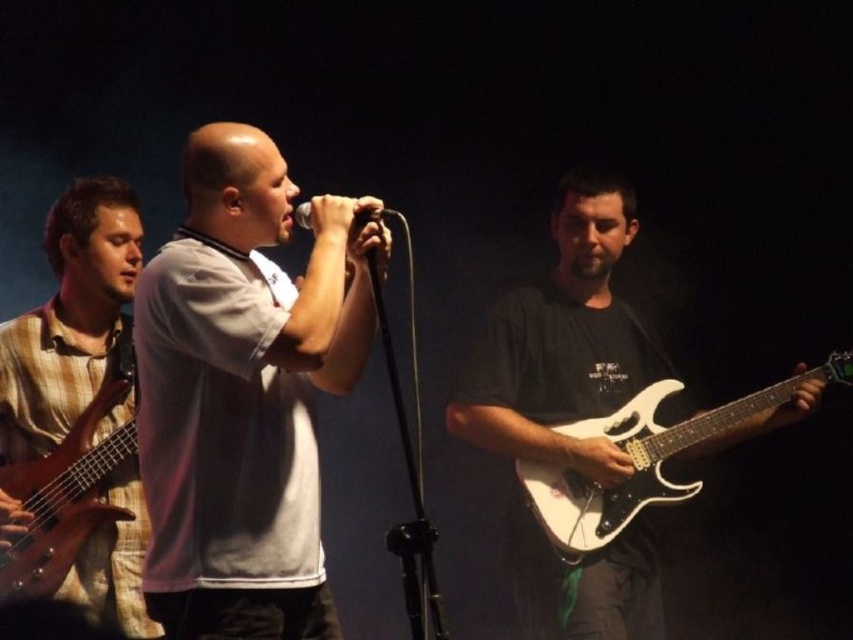
Question: Is white glossy electric guitar at right positioned behind wooden bass guitar at left?

Choices:
 (A) no
 (B) yes

Answer: (B)

Question: Which object is farther from the camera taking this photo?

Choices:
 (A) plaid fabric guitar at left
 (B) white glossy guitar at right

Answer: (B)

Question: Which point is closer to the camera?

Choices:
 (A) white matte shirt at center
 (B) wooden bass guitar at left
 (C) metallic silver microphone at center
 (D) plaid fabric guitar at left

Answer: (A)

Question: Is white matte shirt at center smaller than white glossy electric guitar at right?

Choices:
 (A) yes
 (B) no

Answer: (B)

Question: Is white matte shirt at center above wooden bass guitar at left?

Choices:
 (A) yes
 (B) no

Answer: (A)

Question: Which object appears closest to the camera in this image?

Choices:
 (A) white glossy electric guitar at right
 (B) white matte shirt at center
 (C) wooden bass guitar at left

Answer: (B)